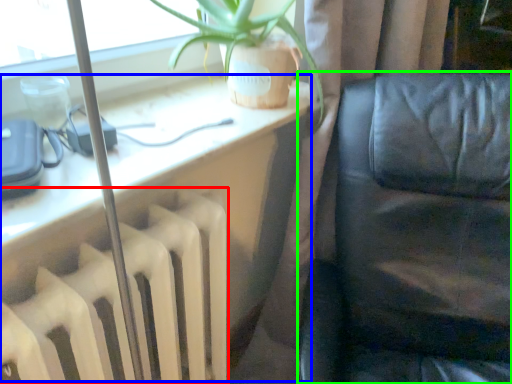
Question: Considering the real-world distances, which object is farthest from radiator (highlighted by a red box)? computer desk (highlighted by a blue box) or furniture (highlighted by a green box)?

Choices:
 (A) computer desk
 (B) furniture

Answer: (B)